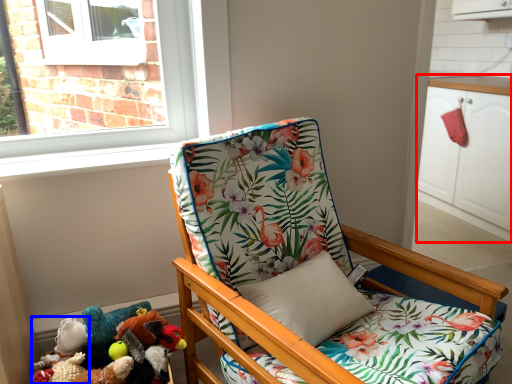
Question: Among these objects, which one is nearest to the camera, cabinetry (highlighted by a red box) or toy (highlighted by a blue box)?

Choices:
 (A) cabinetry
 (B) toy

Answer: (B)